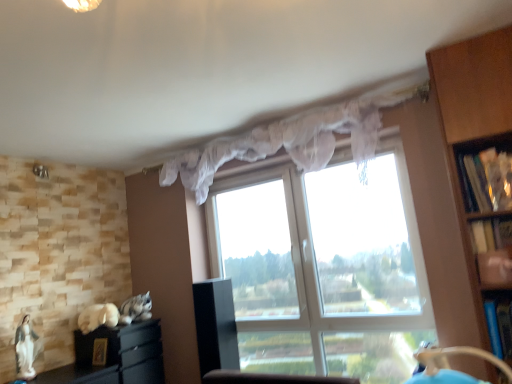
Question: Should I look upward or downward to see blue plastic shelf at right, positioned as the third shelf in top-to-bottom order?

Choices:
 (A) up
 (B) down

Answer: (B)

Question: Can wooden bookshelf at right, which is counted as the 2th shelf, starting from the top, be found inside fluffy gray cat at lower left, arranged as the first animal when viewed from the right?

Choices:
 (A) yes
 (B) no

Answer: (B)

Question: From the image's perspective, is fluffy gray cat at lower left, arranged as the first animal when viewed from the right, below wooden bookshelf at right, which is counted as the 2th shelf, starting from the top?

Choices:
 (A) yes
 (B) no

Answer: (A)

Question: Is fluffy gray cat at lower left, which appears as the 2th animal when viewed from the left, closer to camera compared to wooden bookshelf at right, which is counted as the 2th shelf, starting from the top?

Choices:
 (A) no
 (B) yes

Answer: (A)

Question: Considering the relative positions of fluffy gray cat at lower left, arranged as the first animal when viewed from the right, and wooden bookshelf at right, which is counted as the 2th shelf, starting from the top, in the image provided, is fluffy gray cat at lower left, arranged as the first animal when viewed from the right, to the left of wooden bookshelf at right, which is counted as the 2th shelf, starting from the top, from the viewer's perspective?

Choices:
 (A) no
 (B) yes

Answer: (B)

Question: Is fluffy gray cat at lower left, which appears as the 2th animal when viewed from the left, aimed at wooden bookshelf at right, the second shelf from the bottom?

Choices:
 (A) yes
 (B) no

Answer: (A)

Question: Is fluffy gray cat at lower left, arranged as the first animal when viewed from the right, looking in the opposite direction of wooden bookshelf at right, the second shelf from the bottom?

Choices:
 (A) yes
 (B) no

Answer: (B)

Question: From the image's perspective, is wooden bookshelf at right, the second shelf from the bottom, under wooden bookshelf at right, marked as the third shelf in a bottom-to-top arrangement?

Choices:
 (A) yes
 (B) no

Answer: (A)

Question: Is wooden bookshelf at right, which is counted as the 2th shelf, starting from the top, not near wooden bookshelf at right, marked as the third shelf in a bottom-to-top arrangement?

Choices:
 (A) no
 (B) yes

Answer: (A)

Question: From a real-world perspective, is wooden bookshelf at right, the second shelf from the bottom, located higher than wooden bookshelf at right, which appears as the first shelf when viewed from the top?

Choices:
 (A) yes
 (B) no

Answer: (B)

Question: Considering the relative sizes of wooden bookshelf at right, the second shelf from the bottom, and wooden bookshelf at right, marked as the third shelf in a bottom-to-top arrangement, in the image provided, is wooden bookshelf at right, the second shelf from the bottom, wider than wooden bookshelf at right, marked as the third shelf in a bottom-to-top arrangement,?

Choices:
 (A) yes
 (B) no

Answer: (B)

Question: Is the depth of wooden bookshelf at right, the second shelf from the bottom, less than that of wooden bookshelf at right, which appears as the first shelf when viewed from the top?

Choices:
 (A) no
 (B) yes

Answer: (B)

Question: Does wooden bookshelf at right, which is counted as the 2th shelf, starting from the top, have a greater height compared to wooden bookshelf at right, which appears as the first shelf when viewed from the top?

Choices:
 (A) yes
 (B) no

Answer: (B)

Question: Is black glossy cabinet at center, the second cabinetry in the left-to-right sequence, not inside wooden bookshelf at right, the second shelf from the bottom?

Choices:
 (A) no
 (B) yes

Answer: (B)